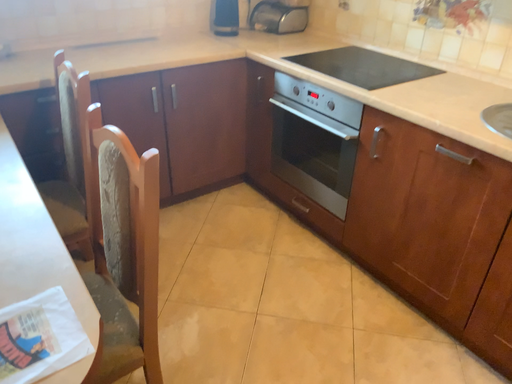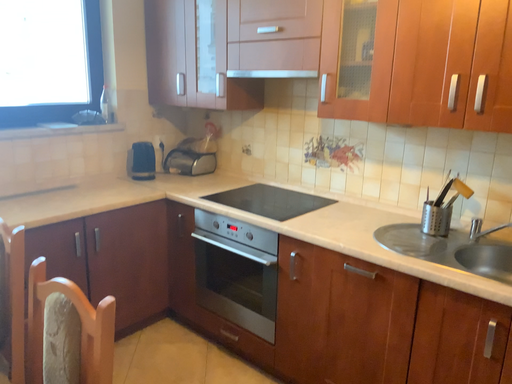
Question: Which way did the camera rotate in the video?

Choices:
 (A) rotated downward
 (B) rotated upward

Answer: (B)